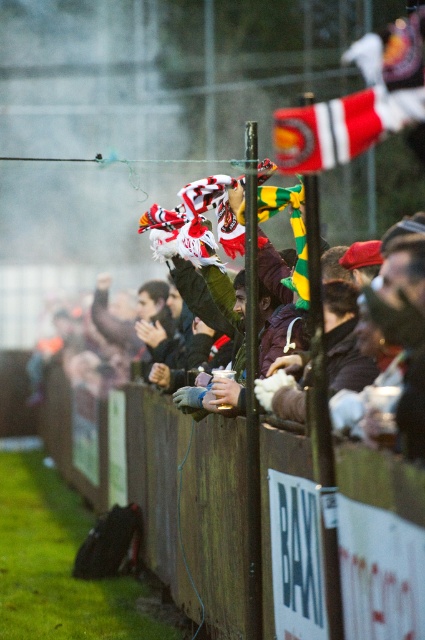
You are a photographer standing near the wooden fence at center and the white and red scarf at center. You want to take a photo of the flag. Which object should you focus on first to ensure the flag is in focus?

The wooden fence at center is closer to the viewer than the white and red scarf at center, so you should focus on the wooden fence at center first to ensure the flag is in focus.

You are a photographer standing near the wooden fence at center and the white and red scarf at center. You want to take a photo that includes both objects in the frame. Given that your camera has a maximum focal length that allows capturing objects up to 2.5 meters apart, will you be able to include both objects in the same photo?

The wooden fence at center and white and red scarf at center are 2.49 meters apart, which is within the camera maximum focal length of 2.5 meters. Therefore, you can include both objects in the same photo.

You are a photographer trying to capture a clear shot of the wooden fence at center and the red and white striped flag at upper right. Which object should you focus on first if you want to ensure both are in focus, considering their sizes?

The wooden fence at center has a smaller size compared to the red and white striped flag at upper right. To ensure both are in focus, you should focus on the wooden fence at center first since smaller objects require a closer focus distance.